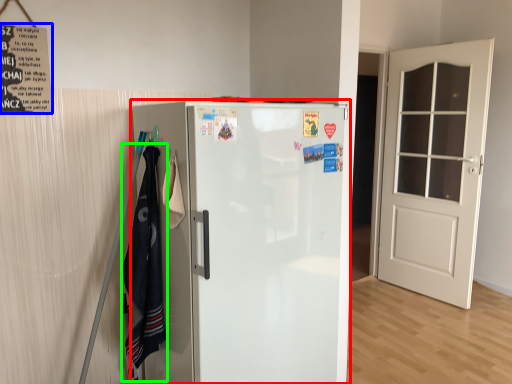
Question: Considering the real-world distances, which object is closest to refrigerator (highlighted by a red box)? poster (highlighted by a blue box) or laundry (highlighted by a green box).

Choices:
 (A) poster
 (B) laundry

Answer: (B)